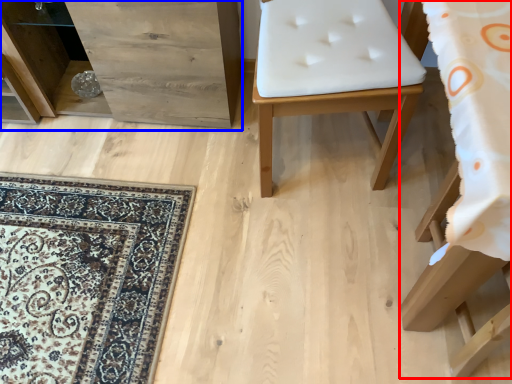
Question: Among these objects, which one is farthest to the camera, furniture (highlighted by a red box) or dresser (highlighted by a blue box)?

Choices:
 (A) furniture
 (B) dresser

Answer: (B)